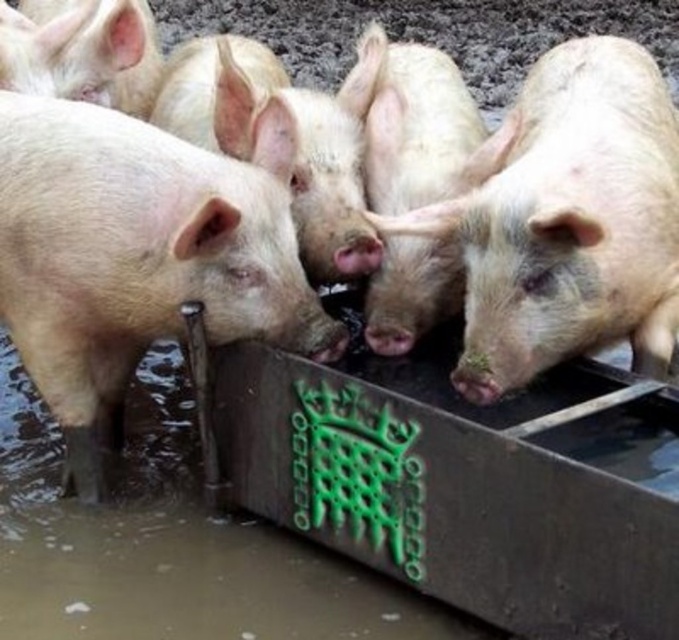
Looking at this image, is pink matte pig at center above pink matte piglet at center?

No.

Is point (35, 324) positioned after point (587, 317)?

That is True.

Between point (96, 416) and point (581, 90), which one is positioned behind?

The point (96, 416) is behind.

Identify the location of pink matte pig at center. This screenshot has height=640, width=679. (139, 257).